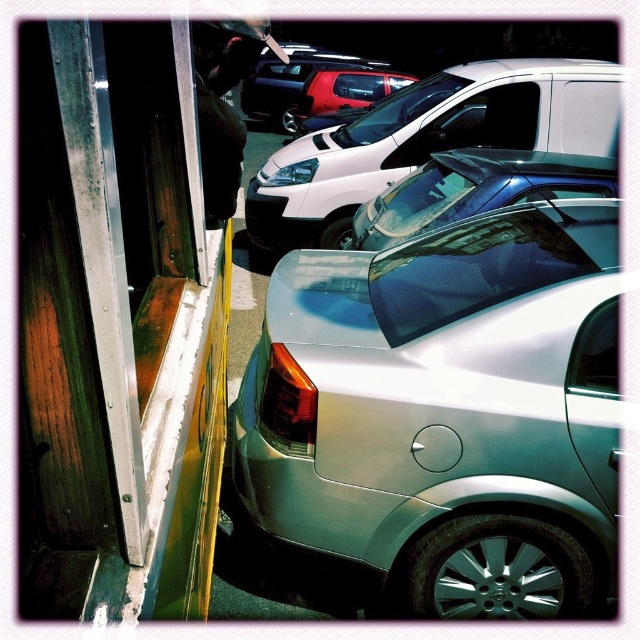
Which is in front, point (417, 320) or point (538, 188)?

Positioned in front is point (417, 320).

Is point (436, 422) farther from camera compared to point (456, 195)?

No, it is not.

Locate an element on the screen. This screenshot has height=640, width=640. satin silver car at center is located at coordinates (444, 416).

Who is shorter, satin white van at center or metallic red suv at center?

With less height is satin white van at center.

Does satin white van at center have a smaller size compared to metallic red suv at center?

Actually, satin white van at center might be larger than metallic red suv at center.

Between point (538, 109) and point (312, 76), which one is positioned behind?

Positioned behind is point (312, 76).

This screenshot has width=640, height=640. I want to click on satin white van at center, so click(x=428, y=140).

Which is below, satin white van at center or metallic blue car at center?

metallic blue car at center is lower down.

Is satin white van at center further to camera compared to metallic blue car at center?

Yes, satin white van at center is behind metallic blue car at center.

Which is behind, point (589, 74) or point (509, 163)?

The point (589, 74) is behind.

Where is `satin white van at center`? satin white van at center is located at coordinates (428, 140).